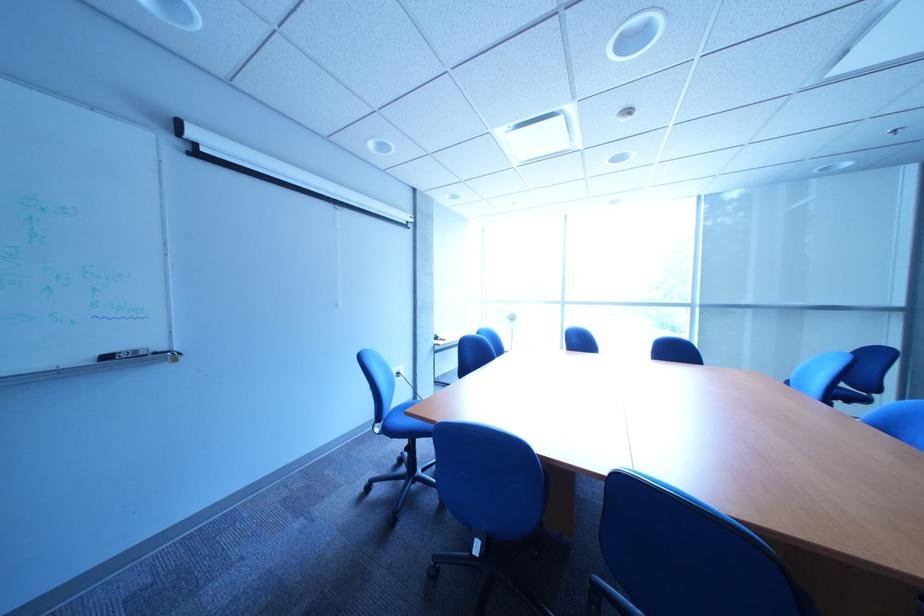
Describe the element at coordinates (405, 424) in the screenshot. I see `the blue chair sitting surface` at that location.